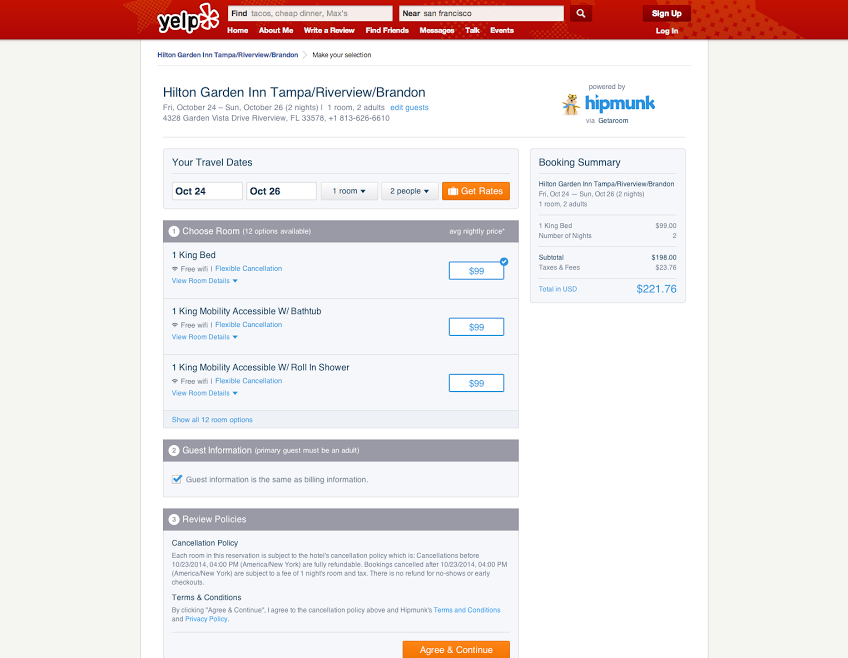
Locate an element on the screen. This screenshot has height=658, width=848. room selections is located at coordinates (227, 266), (227, 310), (232, 376).